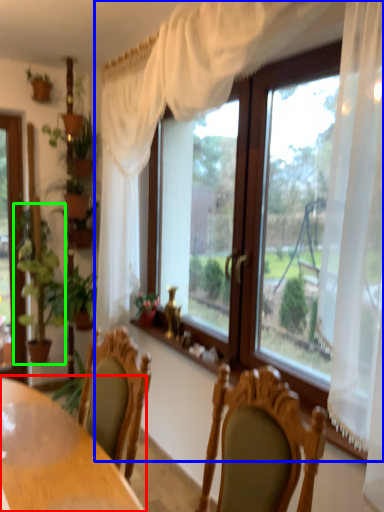
Question: Which object is the closest to the table (highlighted by a red box)? Choose among these: window (highlighted by a blue box) or houseplant (highlighted by a green box).

Choices:
 (A) window
 (B) houseplant

Answer: (A)